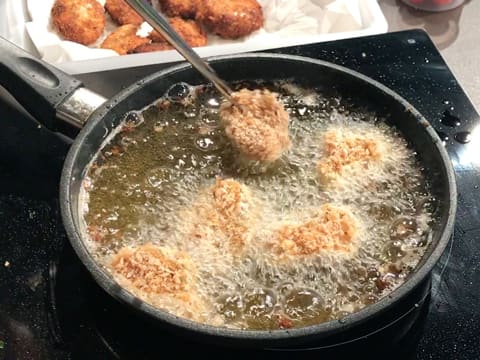
Locate an element on the screen. skillet is located at coordinates (79, 245).